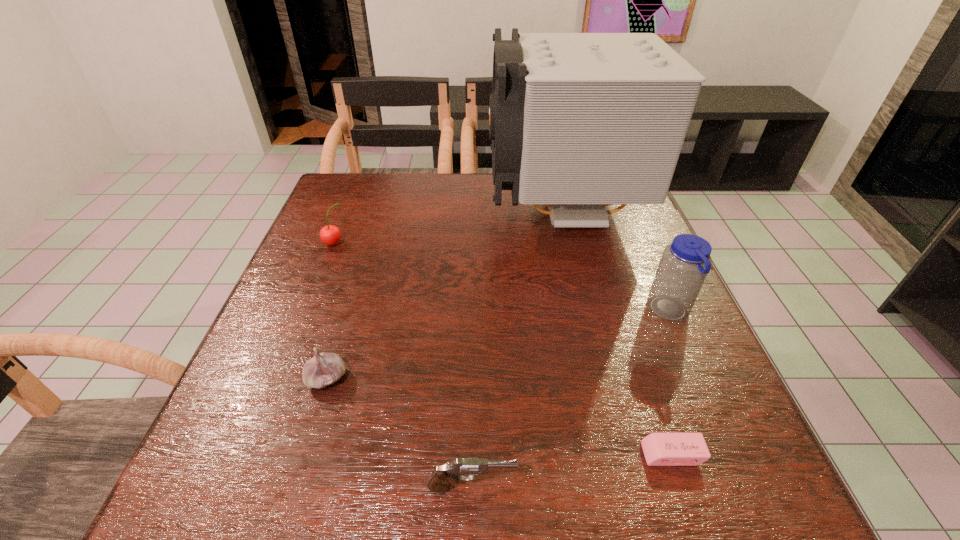
I want to click on blank region between the pistol and the water bottle, so click(570, 399).

This screenshot has width=960, height=540. I want to click on empty space that is in between the pistol and the third farthest object, so click(x=570, y=399).

Image resolution: width=960 pixels, height=540 pixels. I want to click on free space between the pistol and the tallest object, so click(516, 349).

The image size is (960, 540). I want to click on vacant area that lies between the pistol and the leftmost object, so click(403, 365).

At what (x,y) coordinates should I click in order to perform the action: click on vacant area that lies between the fifth object from right to left and the fourth nearest object. Please return your answer as a coordinate pair (x, y). The width and height of the screenshot is (960, 540). Looking at the image, I should click on (498, 345).

Locate an element on the screen. The image size is (960, 540). the fourth closest object to the nearest object is located at coordinates (578, 121).

Locate which object ranks in proximity to the fifth object from right to left. Please provide its 2D coordinates. Your answer should be formatted as a tuple, i.e. [(x, y)], where the tuple contains the x and y coordinates of a point satisfying the conditions above.

[(440, 480)]